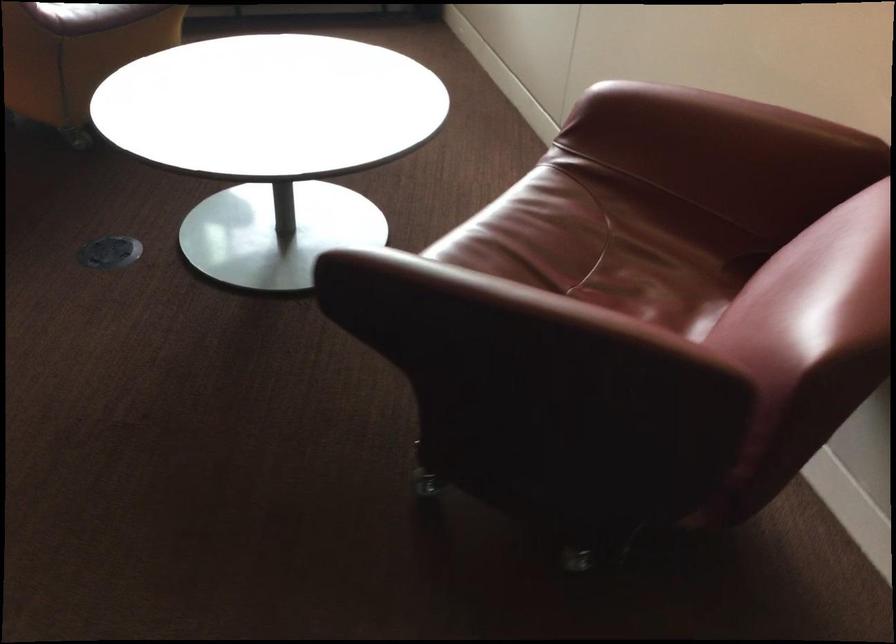
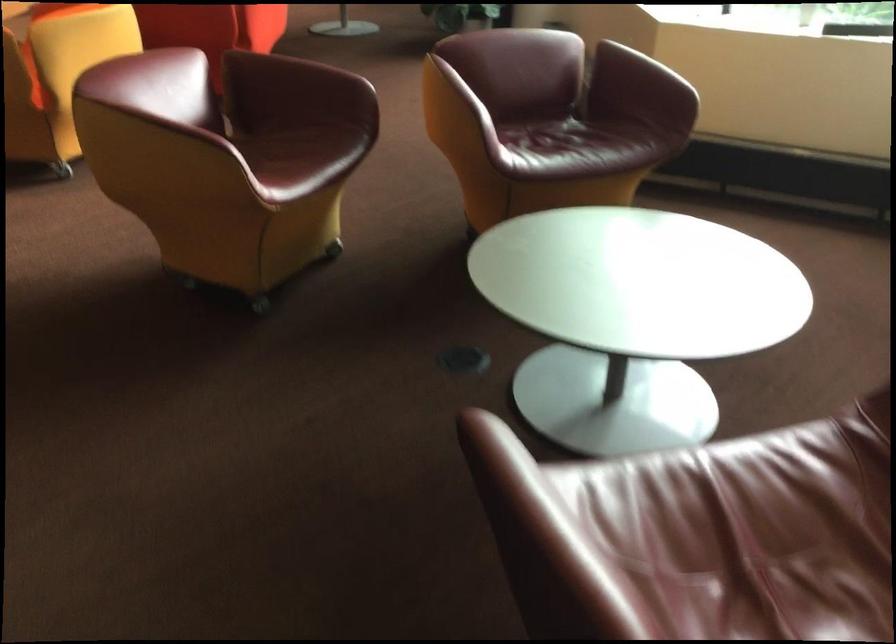
Question: The first image is from the beginning of the video and the second image is from the end. How did the camera likely rotate when shooting the video?

Choices:
 (A) Left
 (B) Right
 (C) Up
 (D) Down

Answer: (A)